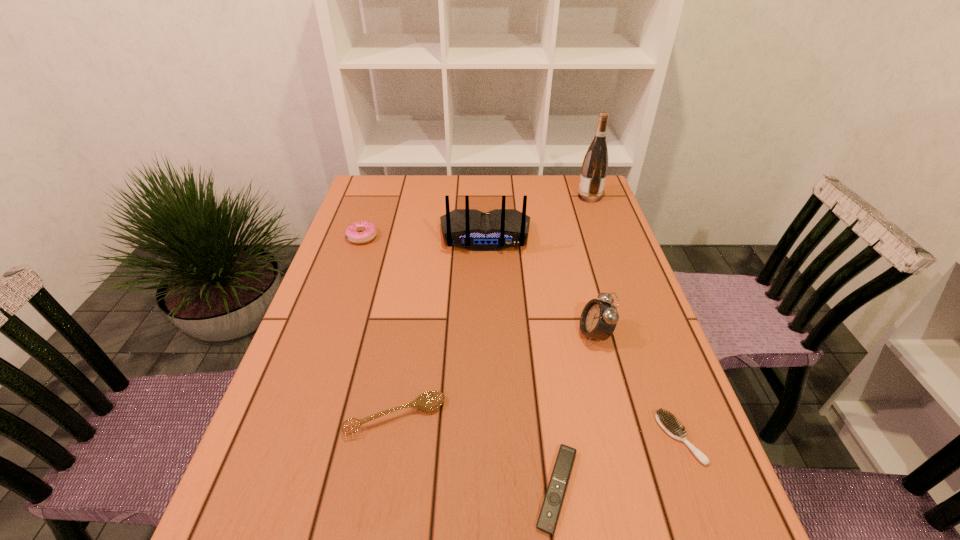
Image resolution: width=960 pixels, height=540 pixels. Identify the location of free point located on the label of the farthest object. (548, 197).

The width and height of the screenshot is (960, 540). What are the coordinates of `blank space located on the label of the farthest object` in the screenshot? It's located at (498, 197).

The height and width of the screenshot is (540, 960). Identify the location of vacant space situated on the label of the farthest object. (484, 197).

Where is `vacant space located 0.080m on the back of the second tallest object`? vacant space located 0.080m on the back of the second tallest object is located at coordinates (486, 273).

Find the location of a particular element. This screenshot has height=540, width=960. blank space located 0.200m on the face of the fifth shortest object is located at coordinates (494, 334).

Find the location of a particular element. This screenshot has width=960, height=540. vacant space situated on the face of the fifth shortest object is located at coordinates (554, 334).

What are the coordinates of `vacant point located on the face of the fifth shortest object` in the screenshot? It's located at (490, 334).

Locate an element on the screen. This screenshot has height=540, width=960. blank space located on the right of the doughnut is located at coordinates (400, 237).

You are a GUI agent. You are given a task and a screenshot of the screen. Output one action in this format:
    pyautogui.click(x=<x>, y=<y>)
    Task: Click on the vacant space located on the back of the ladle
    
    Given the screenshot: What is the action you would take?
    point(410,326)

Find the location of `free space located 0.070m on the left of the sixth tallest object`. free space located 0.070m on the left of the sixth tallest object is located at coordinates [624, 438].